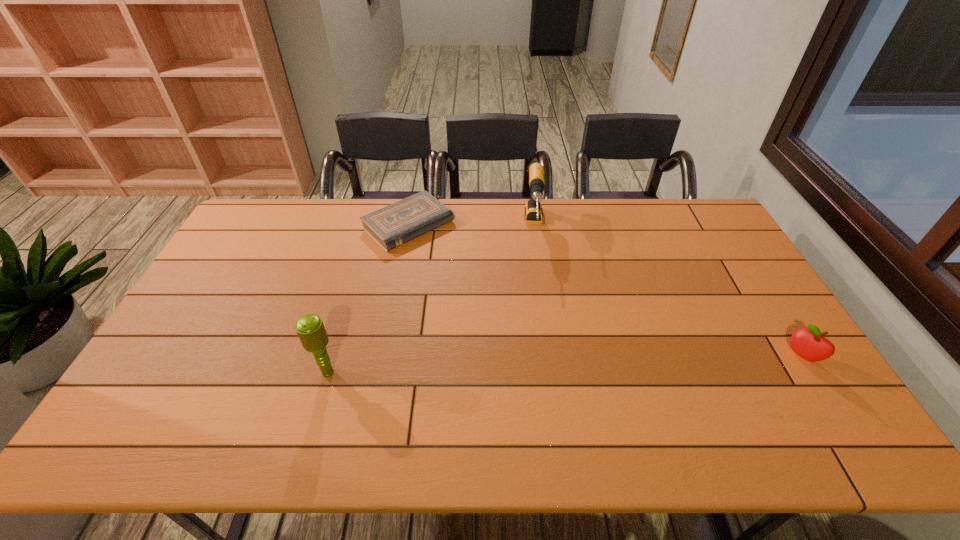
Identify the location of vacant space in between the drill and the microphone. This screenshot has width=960, height=540. (431, 300).

Image resolution: width=960 pixels, height=540 pixels. Find the location of `vacant space in between the microphone and the third tallest object`. vacant space in between the microphone and the third tallest object is located at coordinates (564, 364).

This screenshot has height=540, width=960. Find the location of `vacant space that's between the shortest object and the second shortest object`. vacant space that's between the shortest object and the second shortest object is located at coordinates (605, 291).

This screenshot has width=960, height=540. In order to click on vacant area between the drill and the apple in this screenshot , I will do `click(668, 292)`.

The image size is (960, 540). Find the location of `free space between the shortest object and the microphone`. free space between the shortest object and the microphone is located at coordinates (368, 299).

Point out which object is positioned as the nearest to the rightmost object. Please provide its 2D coordinates. Your answer should be formatted as a tuple, i.e. [(x, y)], where the tuple contains the x and y coordinates of a point satisfying the conditions above.

[(533, 210)]

The image size is (960, 540). I want to click on object that is the third closest to the Bible, so click(x=810, y=344).

The width and height of the screenshot is (960, 540). What are the coordinates of `vacant space that satisfies the following two spatial constraints: 1. on the front side of the apple; 2. on the left side of the shortest object` in the screenshot? It's located at (383, 356).

The height and width of the screenshot is (540, 960). Identify the location of vacant area in the image that satisfies the following two spatial constraints: 1. on the front side of the second object from right to left; 2. on the left side of the rightmost object. (554, 356).

Locate an element on the screen. The height and width of the screenshot is (540, 960). free space that satisfies the following two spatial constraints: 1. on the back side of the microphone; 2. on the right side of the third object from left to right is located at coordinates (371, 227).